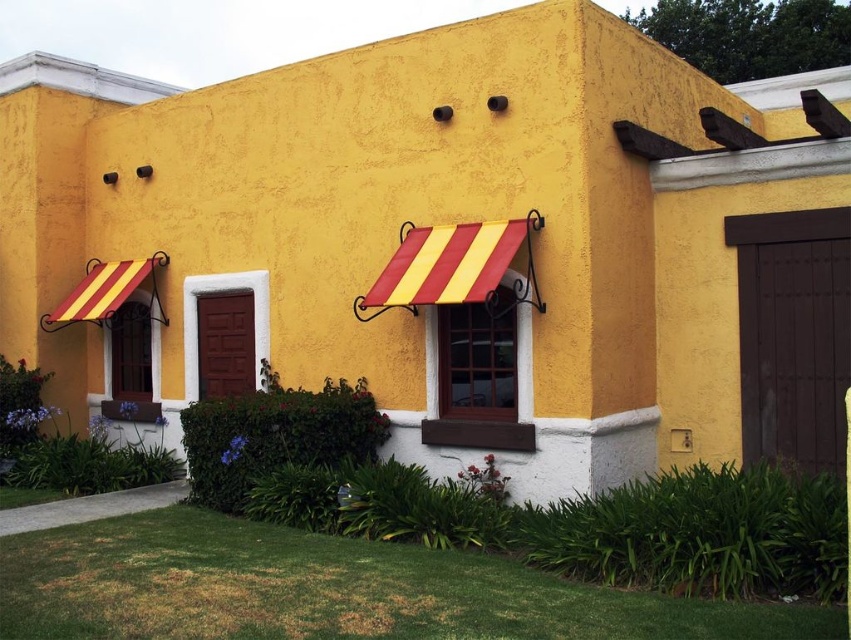
Question: Estimate the real-world distances between objects in this image. Which object is farther from the yellow striped awning at left?

Choices:
 (A) matte wood door at center
 (B) brown wooden door at right

Answer: (B)

Question: Can you confirm if brown wooden door at right is positioned to the left of matte wood door at center?

Choices:
 (A) yes
 (B) no

Answer: (B)

Question: Which point appears closest to the camera in this image?

Choices:
 (A) (204, 371)
 (B) (797, 296)

Answer: (B)

Question: Considering the real-world distances, which object is closest to the yellow striped awning at left?

Choices:
 (A) brown wooden door at right
 (B) matte wood door at center

Answer: (B)

Question: Does brown wooden door at right have a greater width compared to yellow striped awning at left?

Choices:
 (A) yes
 (B) no

Answer: (A)

Question: Does brown wooden door at right appear over yellow striped awning at left?

Choices:
 (A) no
 (B) yes

Answer: (B)